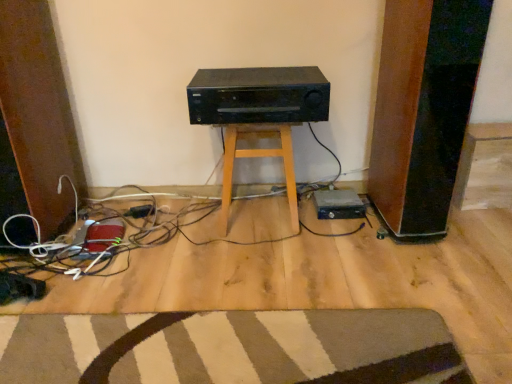
You are a GUI agent. You are given a task and a screenshot of the screen. Output one action in this format:
    pyautogui.click(x=<x>, y=<y>)
    Task: Click on the vacant space that's between black plastic plug at lower center and striped carpet at lower center
    This screenshot has width=512, height=384.
    Given the screenshot: What is the action you would take?
    pyautogui.click(x=200, y=276)